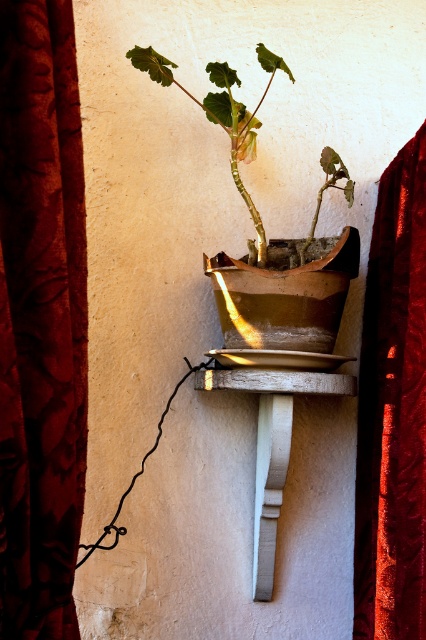
Question: Which point is farther to the camera?

Choices:
 (A) velvet red curtain at right
 (B) white painted wood at center
 (C) velvet dark red curtain at left

Answer: (B)

Question: Which point is farther to the camera?

Choices:
 (A) matte brown pot at center
 (B) velvet dark red curtain at left
 (C) velvet red curtain at right

Answer: (A)

Question: Which object is farther from the camera taking this photo?

Choices:
 (A) matte brown pot at center
 (B) white painted wood at center
 (C) velvet red curtain at right

Answer: (A)

Question: Is matte brown pot at center positioned in front of white painted wood at center?

Choices:
 (A) yes
 (B) no

Answer: (B)

Question: Does matte brown pot at center appear on the right side of white painted wood at center?

Choices:
 (A) no
 (B) yes

Answer: (A)

Question: Does velvet red curtain at right have a larger size compared to white painted wood at center?

Choices:
 (A) yes
 (B) no

Answer: (A)